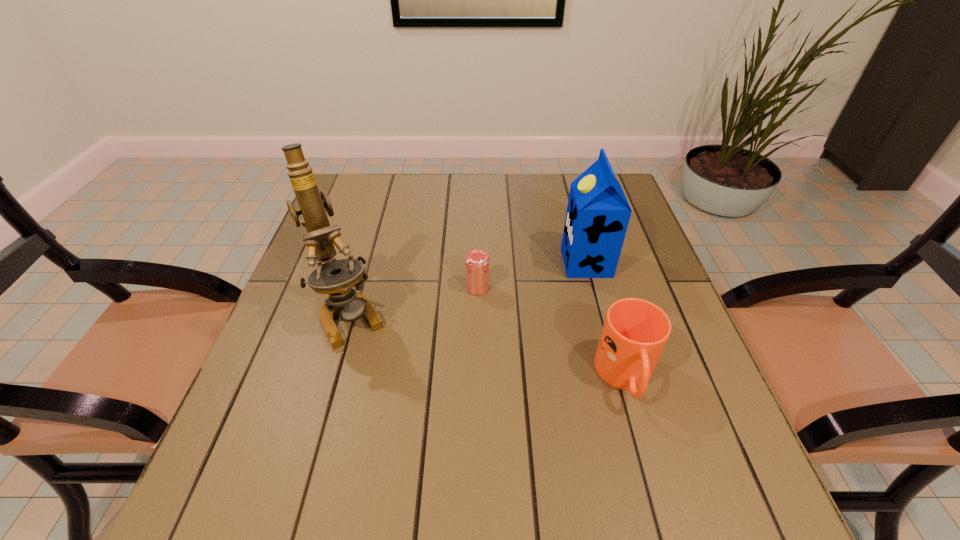
You are a GUI agent. You are given a task and a screenshot of the screen. Output one action in this format:
    pyautogui.click(x=<x>, y=<y>)
    Task: Click on the leftmost object
    This screenshot has height=540, width=960.
    Given the screenshot: What is the action you would take?
    pyautogui.click(x=335, y=277)

Identify the location of microscope. pyautogui.click(x=335, y=277).

Locate an element on the screen. The width and height of the screenshot is (960, 540). the second tallest object is located at coordinates (598, 213).

You are a GUI agent. You are given a task and a screenshot of the screen. Output one action in this format:
    pyautogui.click(x=<x>, y=<y>)
    Task: Click on the carton
    
    Given the screenshot: What is the action you would take?
    pyautogui.click(x=598, y=213)

Where is `mug`? mug is located at coordinates (635, 331).

Where is `beer can`? This screenshot has height=540, width=960. beer can is located at coordinates (477, 261).

Find the location of a particular element. The height and width of the screenshot is (540, 960). the second object from left to right is located at coordinates (477, 261).

You are a GUI agent. You are given a task and a screenshot of the screen. Output one action in this format:
    pyautogui.click(x=<x>, y=<y>)
    Task: Click on the free space located on the front of the tallest object
    
    Given the screenshot: What is the action you would take?
    pyautogui.click(x=322, y=417)

Where is `free region located 0.130m with the cap open on the second tallest object`? The width and height of the screenshot is (960, 540). free region located 0.130m with the cap open on the second tallest object is located at coordinates (514, 262).

I want to click on vacant space located 0.140m with the cap open on the second tallest object, so click(510, 262).